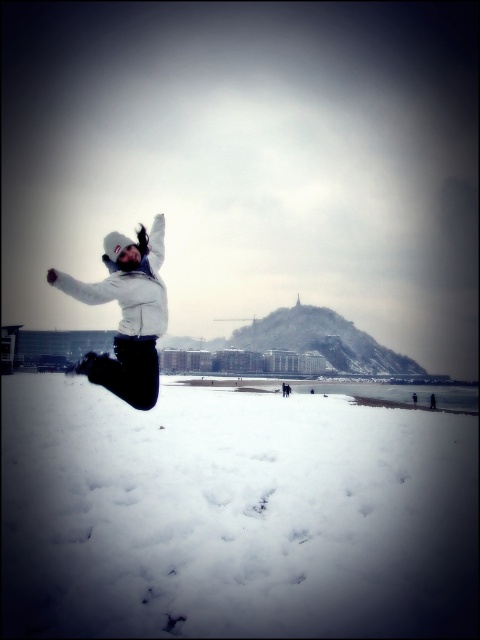
Question: Which of the following is the closest to the observer?

Choices:
 (A) white matte jacket at center
 (B) white fluffy snow at lower center

Answer: (B)

Question: Is the position of white fluffy snow at lower center less distant than that of white matte jacket at center?

Choices:
 (A) yes
 (B) no

Answer: (A)

Question: Is white fluffy snow at lower center bigger than white matte jacket at center?

Choices:
 (A) no
 (B) yes

Answer: (B)

Question: Which object is farther from the camera taking this photo?

Choices:
 (A) white fluffy snow at lower center
 (B) white matte jacket at center

Answer: (B)

Question: In this image, where is white fluffy snow at lower center located relative to white matte jacket at center?

Choices:
 (A) left
 (B) right

Answer: (B)

Question: Which object appears farthest from the camera in this image?

Choices:
 (A) white matte jacket at center
 (B) white fluffy snow at lower center

Answer: (A)